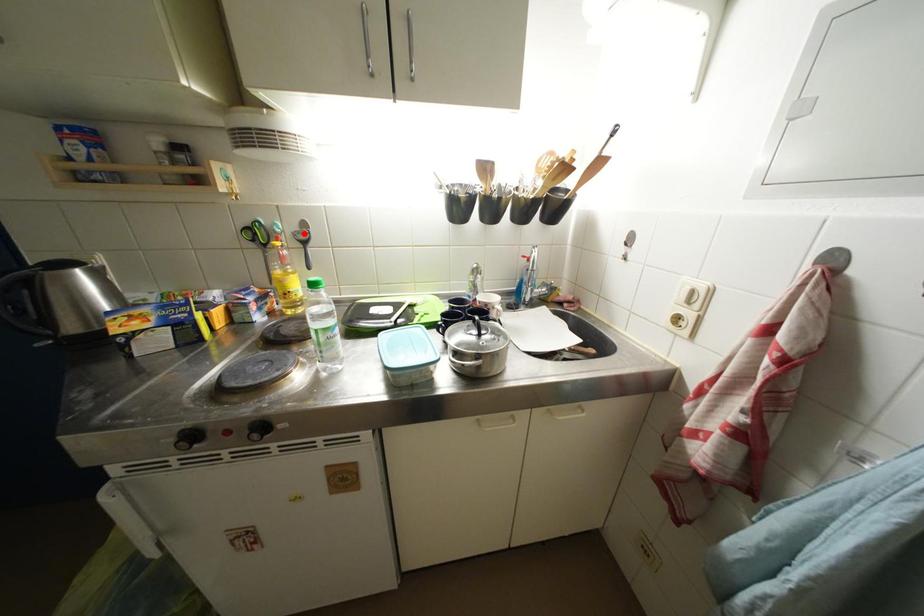
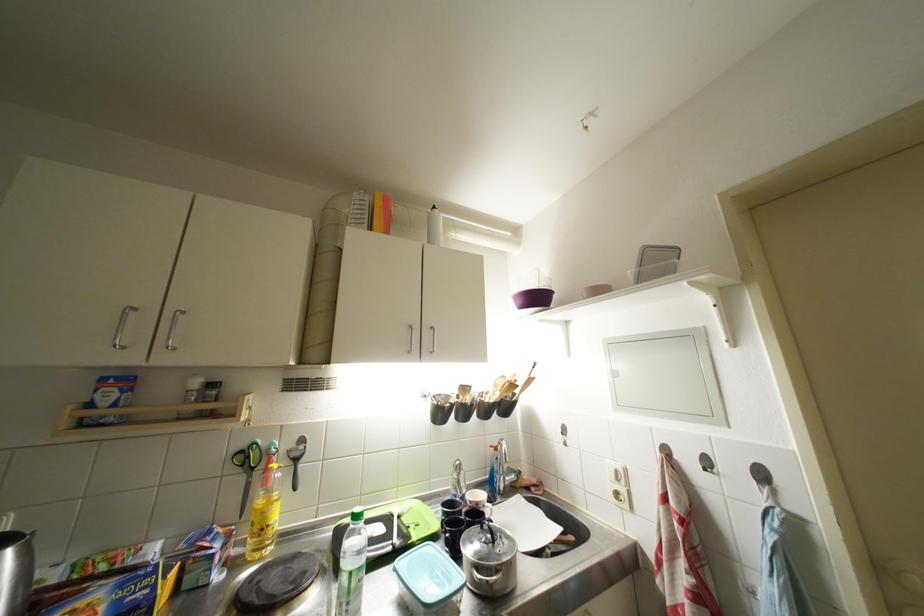
Locate, in the second image, the point that corresponds to the highlighted location in the first image.

(299, 450)